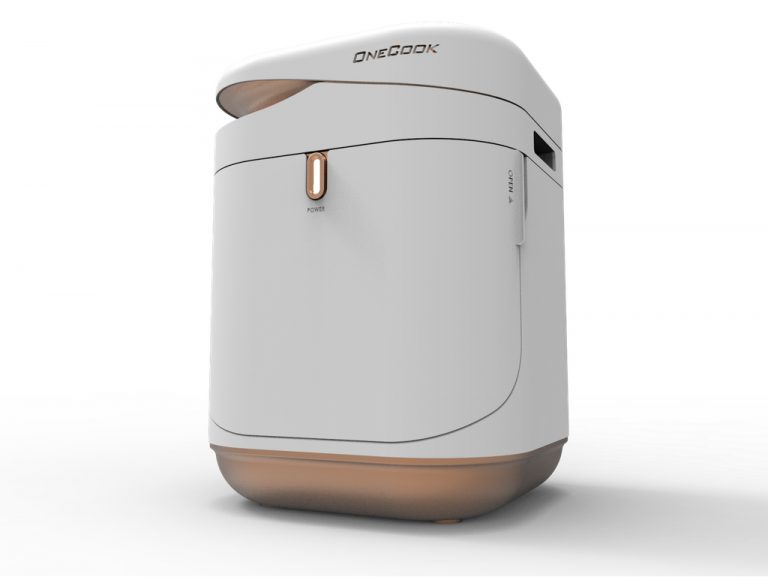
Identify the location of door. (376, 237).